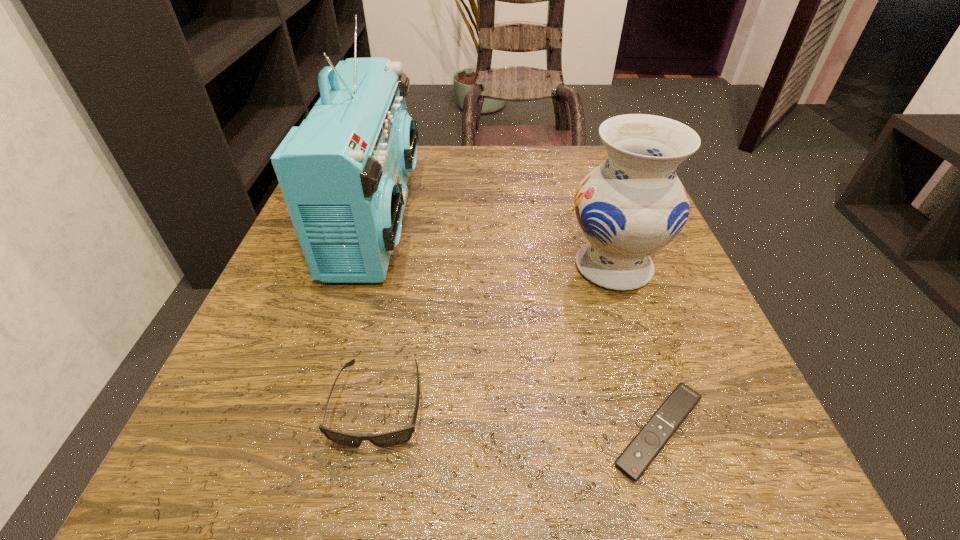
The image size is (960, 540). In order to click on free space between the remote control and the second tallest object in this screenshot , I will do `click(636, 349)`.

At what (x,y) coordinates should I click in order to perform the action: click on vacant area that lies between the third shortest object and the third tallest object. Please return your answer as a coordinate pair (x, y). The image size is (960, 540). Looking at the image, I should click on (496, 335).

Identify which object is the closest to the second tallest object. Please provide its 2D coordinates. Your answer should be formatted as a tuple, i.e. [(x, y)], where the tuple contains the x and y coordinates of a point satisfying the conditions above.

[(643, 449)]

Locate which object ranks third in proximity to the sunglasses. Please provide its 2D coordinates. Your answer should be formatted as a tuple, i.e. [(x, y)], where the tuple contains the x and y coordinates of a point satisfying the conditions above.

[(632, 205)]

Identify the location of vacant area that satisfies the following two spatial constraints: 1. on the back side of the vase; 2. on the front-facing side of the radio receiver. (597, 217).

Find the location of a particular element. vacant space that satisfies the following two spatial constraints: 1. on the front-facing side of the tallest object; 2. on the right side of the shortest object is located at coordinates (314, 431).